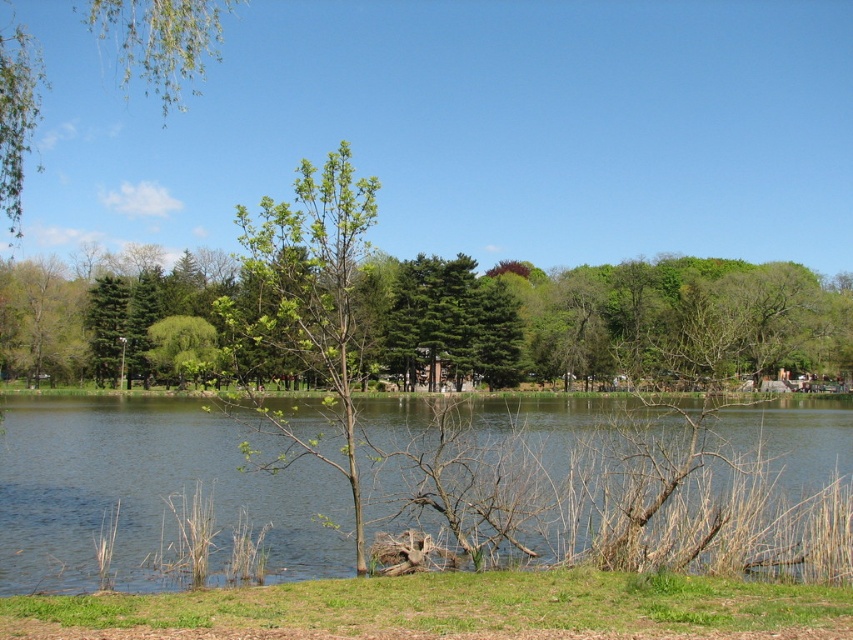
Describe the element at coordinates (149, 492) in the screenshot. I see `clear water at center` at that location.

Which is behind, point (746, 419) or point (614, 362)?

The point (614, 362) is more distant.

Find the location of `clear water at center`. clear water at center is located at coordinates (149, 492).

Is point (215, 544) more distant than point (115, 29)?

No.

Between point (28, 410) and point (181, 77), which one is positioned behind?

The point (181, 77) is more distant.

Find the location of a particular element. clear water at center is located at coordinates (149, 492).

Measure the distance between point (370, 294) and camera.

A distance of 92.50 meters exists between point (370, 294) and camera.

Image resolution: width=853 pixels, height=640 pixels. In order to click on green leafy tree at center in this screenshot , I will do `click(598, 321)`.